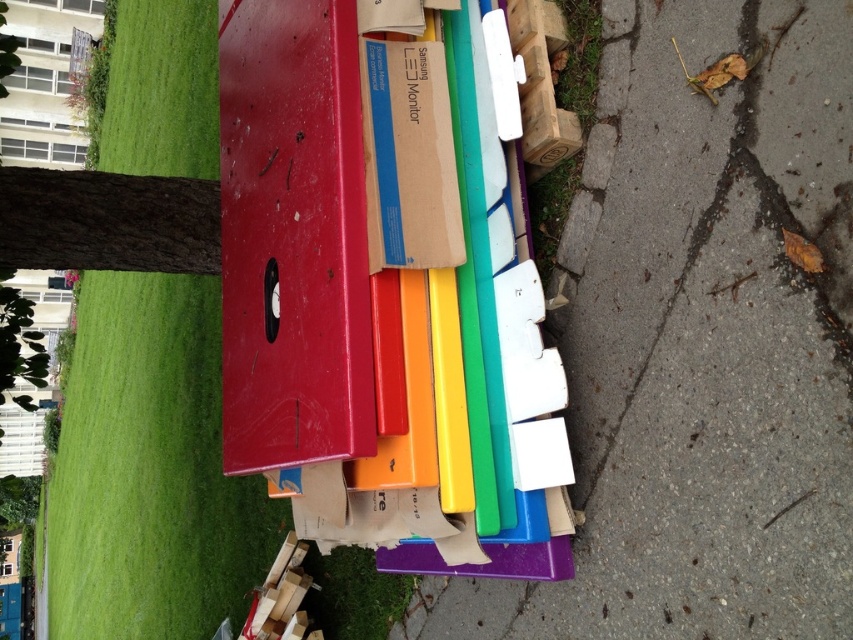
Between smooth concrete pavement at right and green grass at left, which one appears on the right side from the viewer's perspective?

smooth concrete pavement at right is more to the right.

Does point (666, 381) come closer to viewer compared to point (78, 422)?

Yes.

Identify the location of smooth concrete pavement at right. The image size is (853, 640). (700, 344).

Can you confirm if green grass at left is shorter than cardboard samsung monitor at center?

No.

Does green grass at left appear under cardboard samsung monitor at center?

A: Yes.

Who is more forward, (57, 582) or (434, 131)?

Point (434, 131) is in front.

Identify the location of green grass at left. (149, 472).

Does smooth concrete pavement at right have a greater height compared to cardboard samsung monitor at center?

Indeed, smooth concrete pavement at right has a greater height compared to cardboard samsung monitor at center.

Describe the element at coordinates (700, 344) in the screenshot. I see `smooth concrete pavement at right` at that location.

Measure the distance between point (761,496) and camera.

The distance of point (761,496) from camera is 1.46 meters.

You are a GUI agent. You are given a task and a screenshot of the screen. Output one action in this format:
    pyautogui.click(x=<x>, y=<y>)
    Task: Click on the smooth concrete pavement at right
    
    Given the screenshot: What is the action you would take?
    pyautogui.click(x=700, y=344)